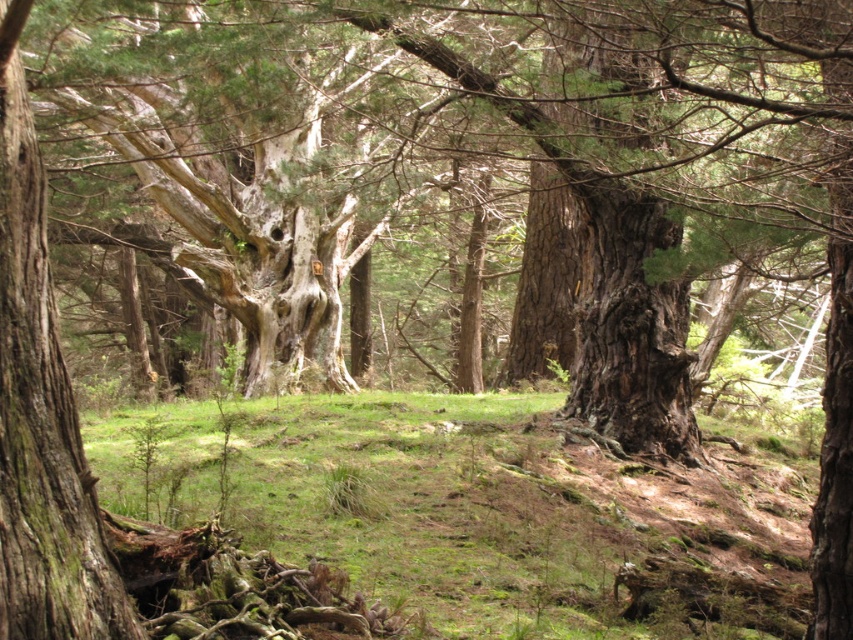
Is green mossy ground at center bigger than smooth bark tree trunk at center?

Indeed, green mossy ground at center has a larger size compared to smooth bark tree trunk at center.

Where is `green mossy ground at center`? The image size is (853, 640). green mossy ground at center is located at coordinates (474, 515).

Who is more forward, (643, 506) or (126, 637)?

Point (126, 637) is in front.

Identify the location of green mossy ground at center. (474, 515).